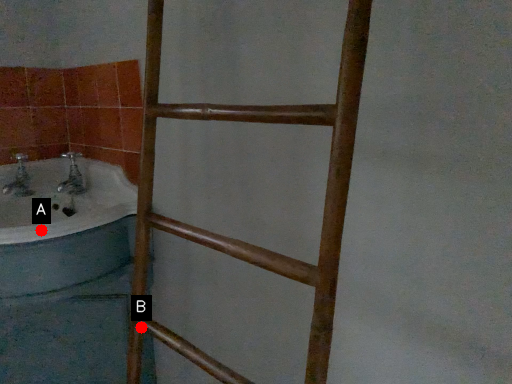
Question: Two points are circled on the image, labeled by A and B beside each circle. Which point is farther to the camera?

Choices:
 (A) A is further
 (B) B is further

Answer: (A)